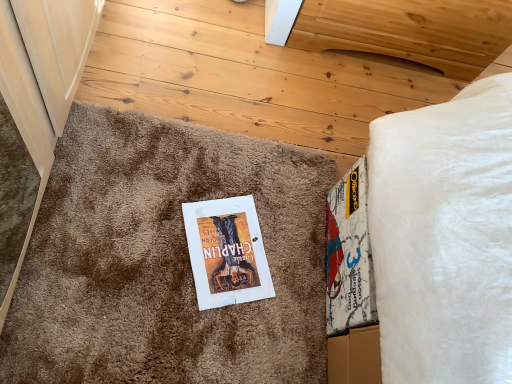
Identify the location of vacant space behind brown shaggy carpet at center. The image size is (512, 384). (257, 79).